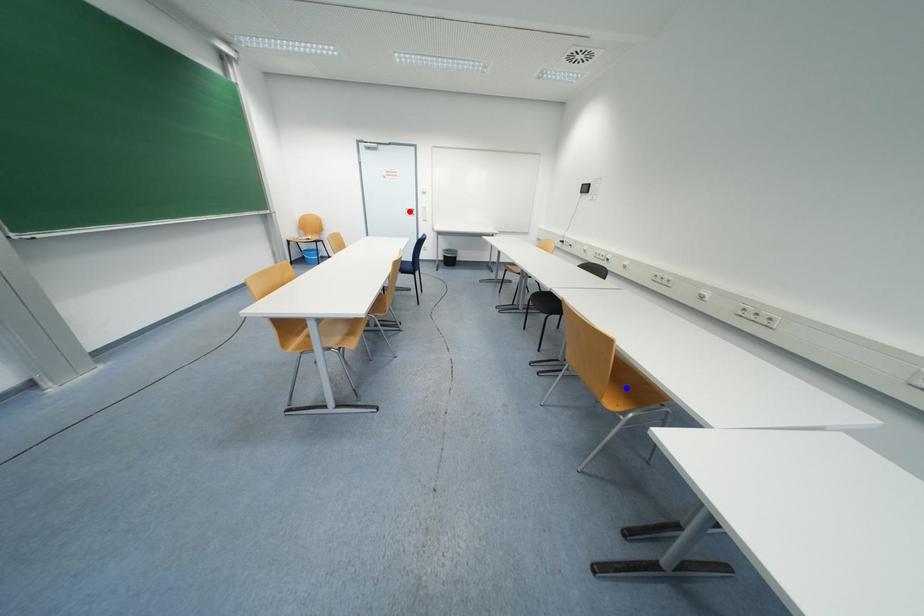
Question: Which of the two points in the image is closer to the camera?

Choices:
 (A) Blue point is closer.
 (B) Red point is closer.

Answer: (A)